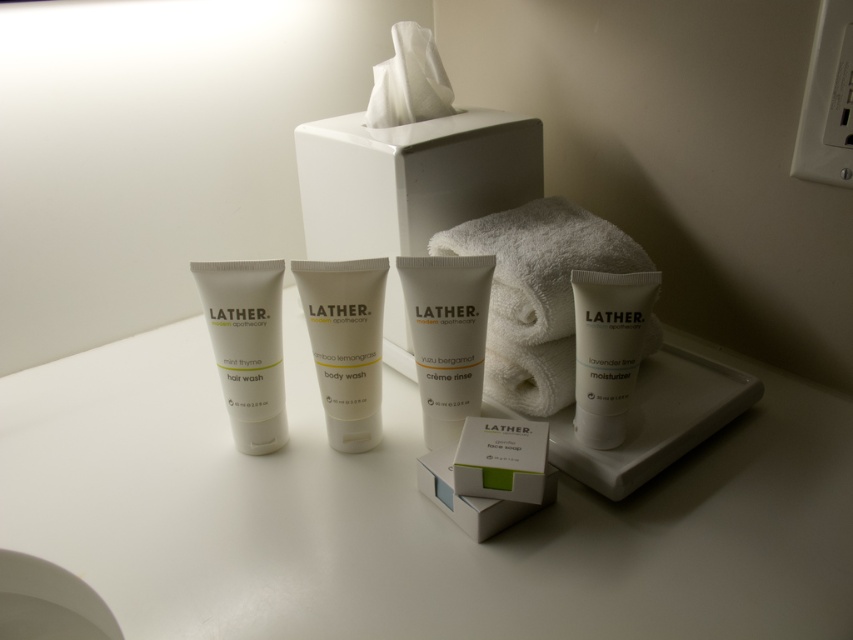
Question: From the image, what is the correct spatial relationship of white matte tissue box at center in relation to white matte moisturizer at center right?

Choices:
 (A) left
 (B) right

Answer: (A)

Question: Considering the real-world distances, which object is closest to the white cardboard box at center?

Choices:
 (A) white matte tube at left
 (B) white matte creme rinse at center
 (C) white matte moisturizer at center right
 (D) white matte counter top at center

Answer: (B)

Question: Can you confirm if white matte tissue box at center is positioned below white matte creme rinse at center?

Choices:
 (A) no
 (B) yes

Answer: (A)

Question: Which object is positioned closest to the white soft towel at center?

Choices:
 (A) white matte counter top at center
 (B) white matte moisturizer at center right
 (C) white matte tube at left
 (D) white matte creme rinse at center

Answer: (B)

Question: Does white soft towel at center appear over white matte body wash at center?

Choices:
 (A) no
 (B) yes

Answer: (B)

Question: Which of these objects is positioned farthest from the white matte body wash at center?

Choices:
 (A) white matte tissue box at center
 (B) white matte creme rinse at center
 (C) white matte moisturizer at center right

Answer: (C)